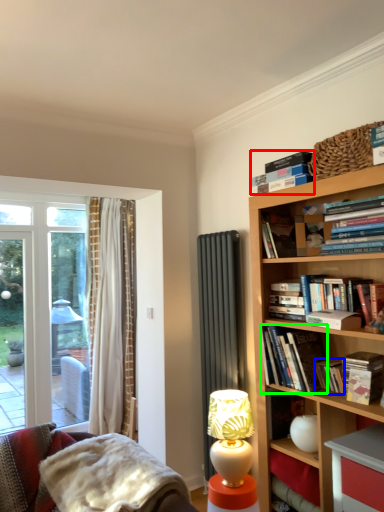
Question: Which is farther away from book (highlighted by a red box)? paperback book (highlighted by a blue box) or book (highlighted by a green box)?

Choices:
 (A) paperback book
 (B) book

Answer: (A)